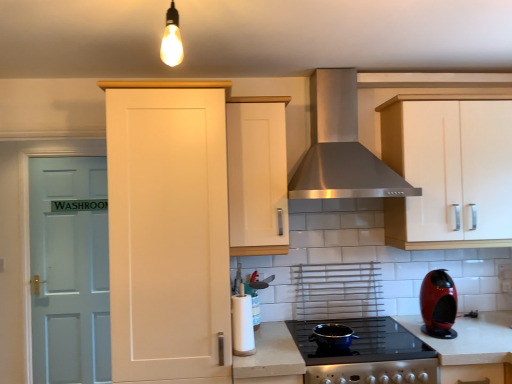
Question: From the image's perspective, is light blue wood door at left beneath white matte cabinet at upper right, marked as the 1th cabinetry in a right-to-left arrangement?

Choices:
 (A) no
 (B) yes

Answer: (B)

Question: Does light blue wood door at left appear on the left side of white matte cabinet at upper right, which is the 3th cabinetry in left-to-right order?

Choices:
 (A) yes
 (B) no

Answer: (A)

Question: From the image's perspective, is light blue wood door at left on white matte cabinet at upper right, which is the 3th cabinetry in left-to-right order?

Choices:
 (A) yes
 (B) no

Answer: (B)

Question: Would you say light blue wood door at left is outside white matte cabinet at upper right, marked as the 1th cabinetry in a right-to-left arrangement?

Choices:
 (A) no
 (B) yes

Answer: (B)

Question: Is light blue wood door at left thinner than white matte cabinet at upper right, marked as the 1th cabinetry in a right-to-left arrangement?

Choices:
 (A) yes
 (B) no

Answer: (A)

Question: In terms of width, does white matte cabinet at upper right, marked as the 1th cabinetry in a right-to-left arrangement, look wider or thinner when compared to matte white cabinet at left, placed as the third cabinetry when sorted from right to left?

Choices:
 (A) thin
 (B) wide

Answer: (A)

Question: Is point (490, 180) closer or farther from the camera than point (137, 94)?

Choices:
 (A) farther
 (B) closer

Answer: (A)

Question: In the image, is white matte cabinet at upper right, which is the 3th cabinetry in left-to-right order, on the left side or the right side of matte white cabinet at left, placed as the third cabinetry when sorted from right to left?

Choices:
 (A) right
 (B) left

Answer: (A)

Question: From their relative heights in the image, would you say white matte cabinet at upper right, marked as the 1th cabinetry in a right-to-left arrangement, is taller or shorter than matte white cabinet at left, the first cabinetry when ordered from left to right?

Choices:
 (A) short
 (B) tall

Answer: (A)

Question: From the image's perspective, relative to matte white cabinet at center, the 2th cabinetry when ordered from left to right, is stainless steel range hood at center above or below?

Choices:
 (A) below
 (B) above

Answer: (B)

Question: Considering the positions of stainless steel range hood at center and matte white cabinet at center, the 2th cabinetry when ordered from left to right, in the image, is stainless steel range hood at center wider or thinner than matte white cabinet at center, the 2th cabinetry when ordered from left to right,?

Choices:
 (A) wide
 (B) thin

Answer: (A)

Question: Is point (361, 147) positioned closer to the camera than point (268, 208)?

Choices:
 (A) farther
 (B) closer

Answer: (A)

Question: In the image, is stainless steel range hood at center positioned in front of or behind matte white cabinet at center, which is counted as the 2th cabinetry, starting from the right?

Choices:
 (A) front
 (B) behind

Answer: (A)

Question: Looking at their shapes, would you say matte black pot at center, which is the first appliance in right-to-left order, is wider or thinner than black glass cooktop at center?

Choices:
 (A) wide
 (B) thin

Answer: (B)

Question: From their relative heights in the image, would you say matte black pot at center, the 2th appliance viewed from the left, is taller or shorter than black glass cooktop at center?

Choices:
 (A) short
 (B) tall

Answer: (A)